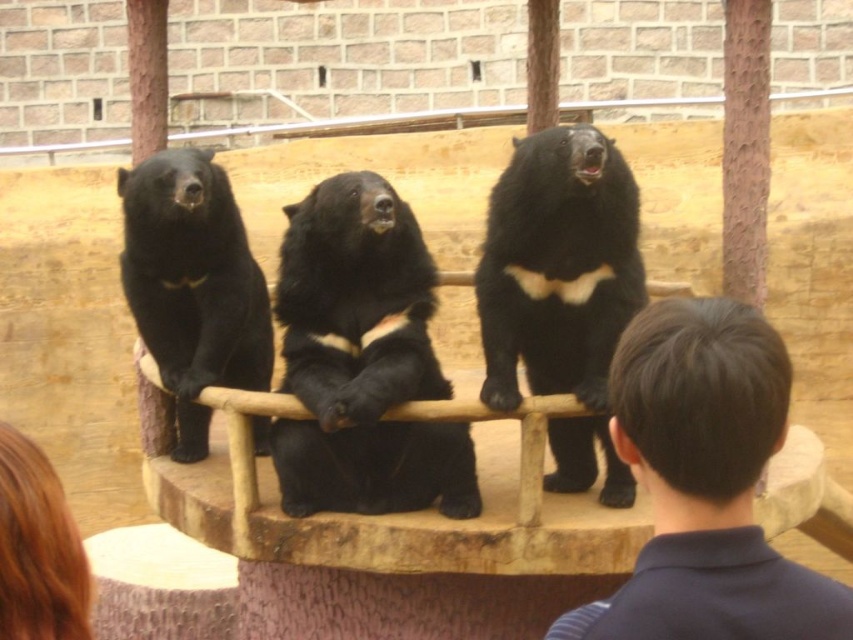
Question: Which point is closer to the camera?

Choices:
 (A) (590, 305)
 (B) (242, 291)
 (C) (302, 481)
 (D) (682, 492)

Answer: (D)

Question: Can you confirm if black fur bear at center is thinner than black furry bear at center?

Choices:
 (A) no
 (B) yes

Answer: (A)

Question: Which object is the farthest from the black fur bear at center?

Choices:
 (A) black furry bear at center
 (B) black fur bear at left
 (C) dark brown hair at upper right

Answer: (C)

Question: Can you confirm if black fur bear at center is thinner than black furry bear at center?

Choices:
 (A) yes
 (B) no

Answer: (B)

Question: Is dark brown hair at upper right positioned at the back of black furry bear at center?

Choices:
 (A) no
 (B) yes

Answer: (A)

Question: Among these points, which one is farthest from the camera?

Choices:
 (A) click(379, 227)
 (B) click(605, 342)

Answer: (B)